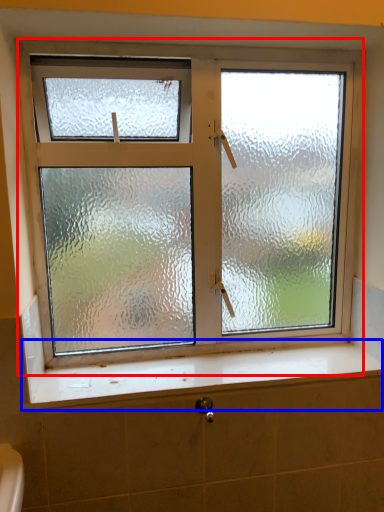
Question: Which object is further to the camera taking this photo, window (highlighted by a red box) or window sill (highlighted by a blue box)?

Choices:
 (A) window
 (B) window sill

Answer: (A)